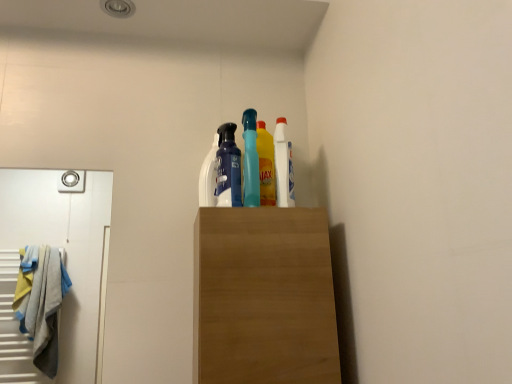
Question: Is white glossy bottle at upper center, the 2th cleaning product viewed from the right, bigger or smaller than white plastic bottle at upper center, marked as the 1th cleaning product in a right-to-left arrangement?

Choices:
 (A) small
 (B) big

Answer: (A)

Question: In the image, is white glossy bottle at upper center, which is the 1th cleaning product from left to right, on the left side or the right side of white plastic bottle at upper center, which ranks as the 2th cleaning product in left-to-right order?

Choices:
 (A) right
 (B) left

Answer: (B)

Question: Which object is the farthest from the matte blue spray bottle at center?

Choices:
 (A) white glossy bottle at upper center, which is the 1th cleaning product from left to right
 (B) white plastic bottle at upper center, marked as the 1th cleaning product in a right-to-left arrangement

Answer: (B)

Question: Based on their relative distances, which object is farther from the white glossy bottle at upper center, the 2th cleaning product viewed from the right?

Choices:
 (A) matte blue spray bottle at center
 (B) white plastic bottle at upper center, which ranks as the 2th cleaning product in left-to-right order

Answer: (B)